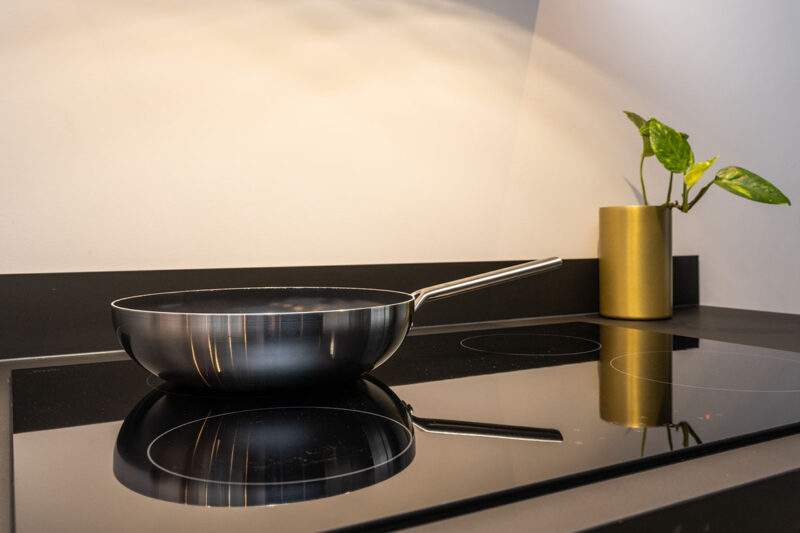
The width and height of the screenshot is (800, 533). Identify the location of back left burner. (541, 338).